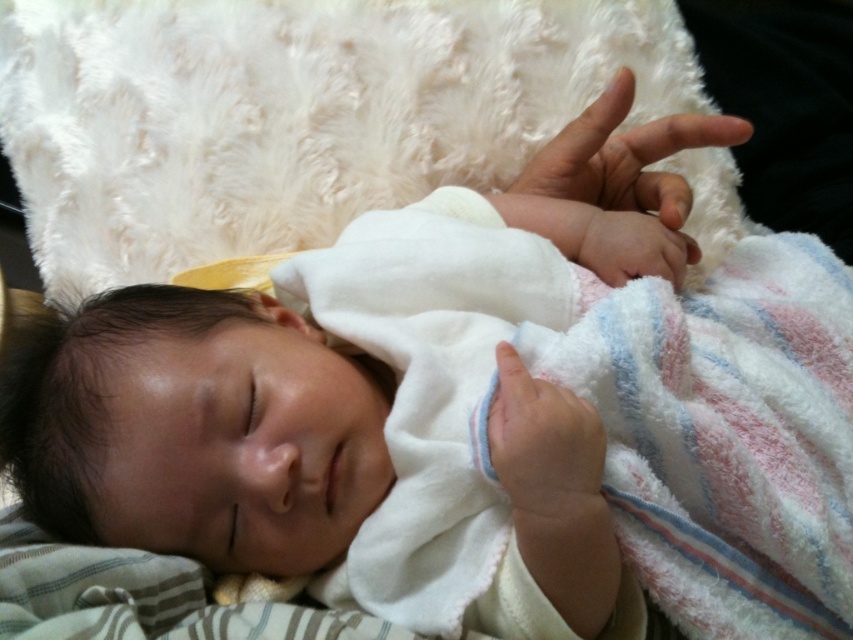
Is pink soft skin at center to the left of smooth white hand at center from the viewer's perspective?

Incorrect, pink soft skin at center is not on the left side of smooth white hand at center.

In the scene shown: Can you confirm if pink soft skin at center is positioned above smooth white hand at center?

Indeed, pink soft skin at center is positioned over smooth white hand at center.

Does point (608, 104) come in front of point (553, 483)?

That is False.

This screenshot has height=640, width=853. Find the location of `pink soft skin at center`. pink soft skin at center is located at coordinates (614, 188).